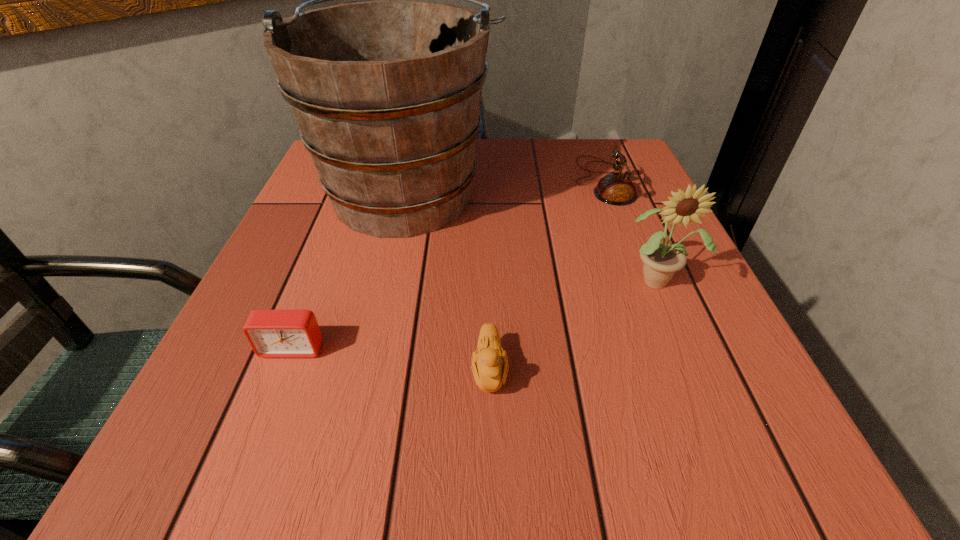
The image size is (960, 540). Identify the location of free spot that satisfies the following two spatial constraints: 1. on the rotary dial of the telephone; 2. on the front-facing side of the alarm clock. (667, 348).